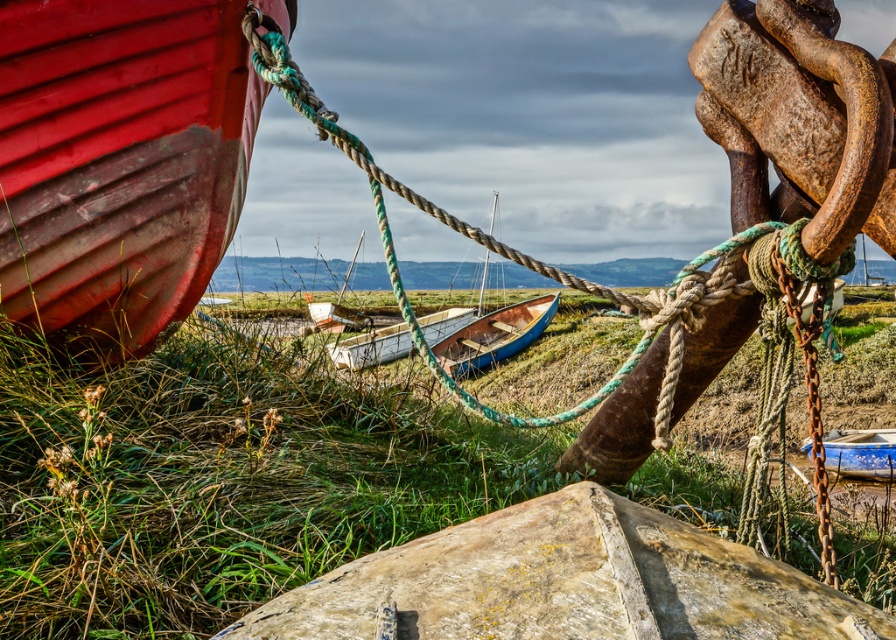
Is point (545, 304) closer to camera compared to point (365, 342)?

No, it is not.

Is wooden boat at center taller than white matte canoe at center?

Correct, wooden boat at center is much taller as white matte canoe at center.

Who is more distant from viewer, (x=549, y=305) or (x=450, y=323)?

Point (x=549, y=305)

The image size is (896, 640). I want to click on wooden boat at center, so click(x=494, y=333).

In the scene shown: Who is taller, green grass at lower left or matte wooden boat at left?

matte wooden boat at left

Which is below, green grass at lower left or matte wooden boat at left?

Positioned lower is green grass at lower left.

Who is more distant from viewer, (448, 432) or (231, 176)?

The point (448, 432) is more distant.

Find the location of a particular element. Image resolution: width=896 pixels, height=640 pixels. green grass at lower left is located at coordinates (224, 477).

Who is higher up, blue wooden boat at center or white matte canoe at center?

blue wooden boat at center is above.

Is blue wooden boat at center thinner than white matte canoe at center?

Correct, blue wooden boat at center's width is less than white matte canoe at center's.

Who is more forward, (540, 326) or (395, 355)?

Positioned in front is point (395, 355).

Where is `blue wooden boat at center`? Image resolution: width=896 pixels, height=640 pixels. blue wooden boat at center is located at coordinates (494, 332).